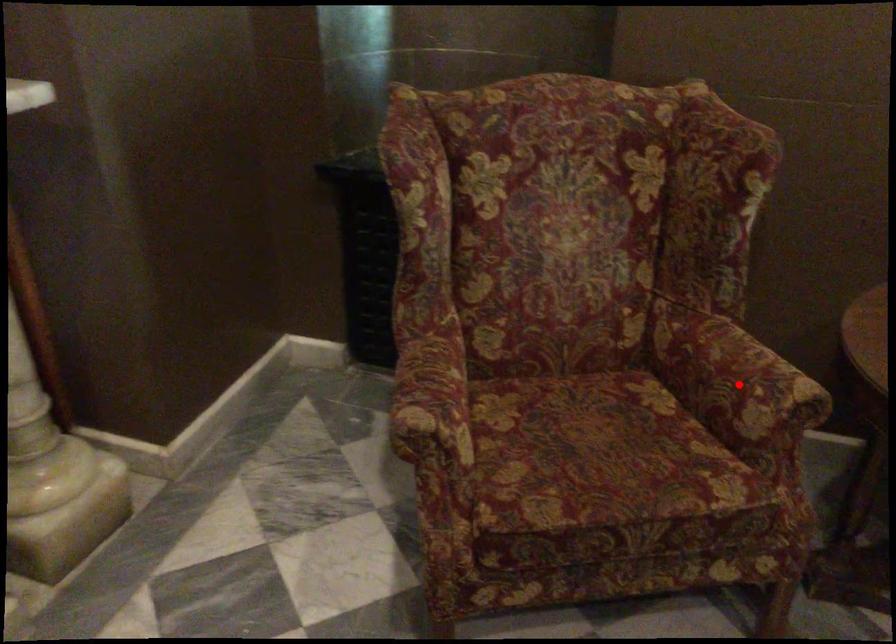
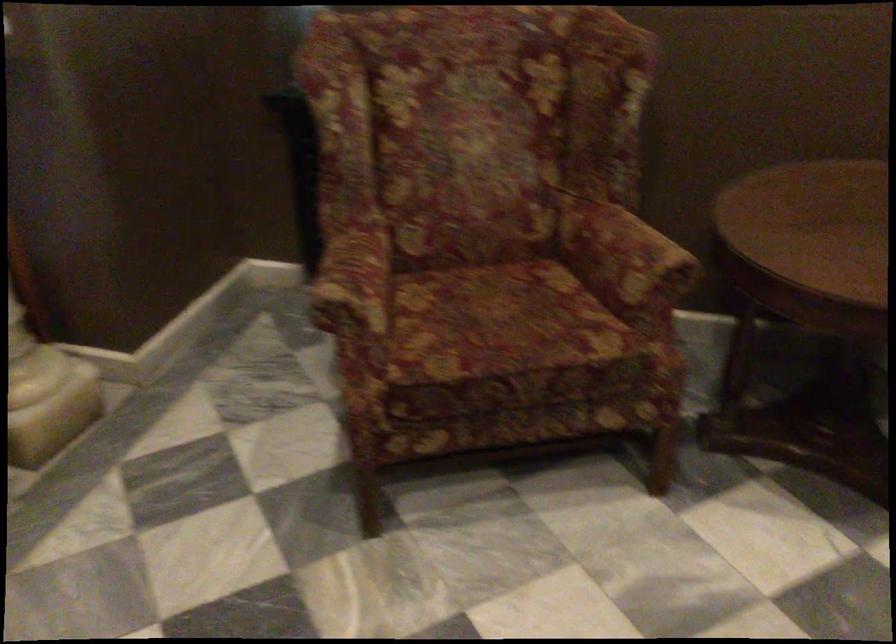
Question: A red point is marked in image1. In image2, is the corresponding 3D point closer to the camera or farther? Reply with the corresponding letter.

Choices:
 (A) The corresponding 3D point is closer.
 (B) The corresponding 3D point is farther.

Answer: (B)